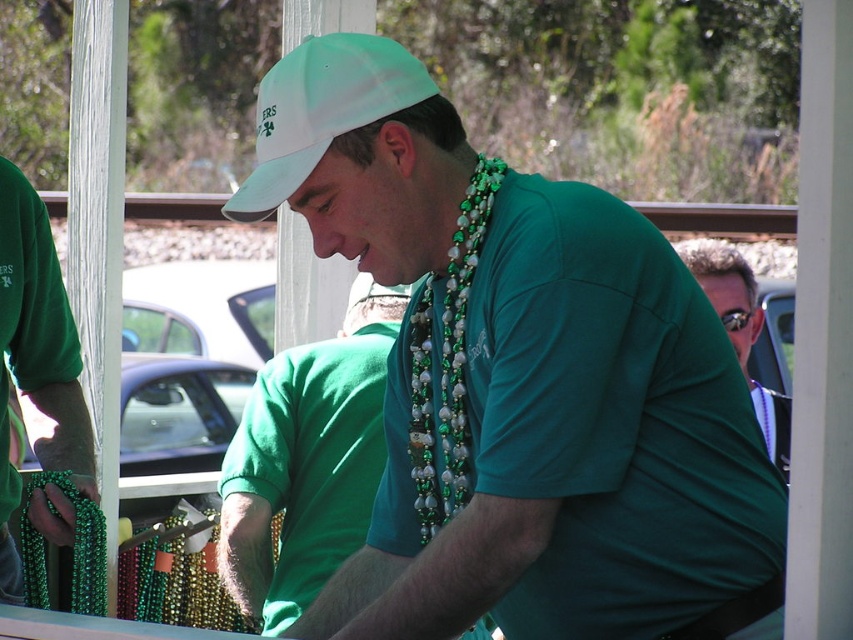
You are a photographer standing on the porch. You need to capture a photo where both the white fabric cap at upper center and the green pearl beads at center are clearly visible. Based on their heights, which object might appear smaller in the photo?

The white fabric cap at upper center has a lesser height compared to green pearl beads at center, so it might appear smaller in the photo.

You are a photographer trying to capture a photo of both the green matte cap at center and the green matte beads at left. From which side of the scene should you position yourself to ensure both objects are visible in the frame?

You should position yourself to the right of the scene because the green matte cap at center is to the right of the green matte beads at left, so placing yourself on the right side will keep both objects within the frame.

You are standing on the porch and need to place a new decoration exactly at the coordinates where the green matte cap at center is located. What object is currently at those coordinates?

The green matte cap at center is located at point [519,381], so the object currently at those coordinates is the green matte cap at center.